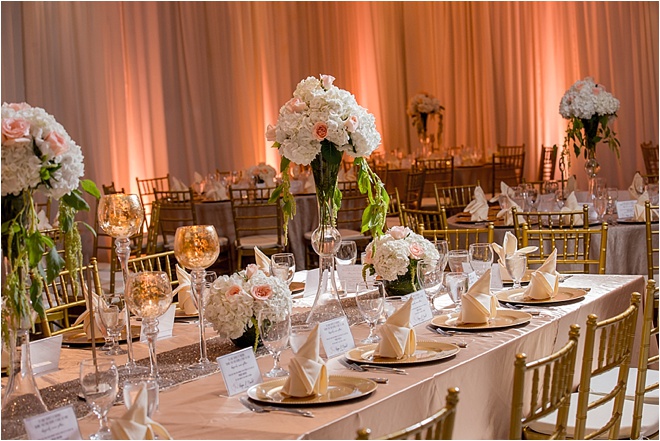
The height and width of the screenshot is (441, 660). In order to click on curtains in this screenshot , I will do `click(457, 61)`.